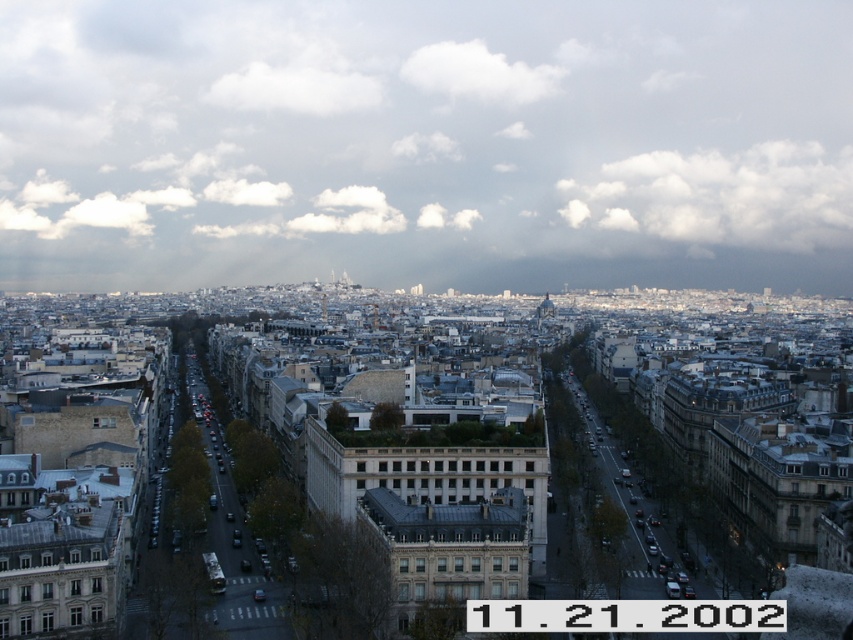
Question: Considering the relative positions of white fluffy clouds at upper center and white fluffy cloud at upper right in the image provided, where is white fluffy clouds at upper center located with respect to white fluffy cloud at upper right?

Choices:
 (A) right
 (B) left

Answer: (B)

Question: From the image, what is the correct spatial relationship of white fluffy clouds at upper center in relation to white fluffy cloud at upper center?

Choices:
 (A) right
 (B) left

Answer: (B)

Question: Based on their relative distances, which object is nearer to the white fluffy cloud at upper right?

Choices:
 (A) white fluffy cloud at upper center
 (B) white fluffy clouds at upper center

Answer: (B)

Question: From the image, what is the correct spatial relationship of white fluffy cloud at upper right in relation to white fluffy cloud at upper center?

Choices:
 (A) above
 (B) below

Answer: (B)

Question: Based on their relative distances, which object is farther from the white fluffy cloud at upper right?

Choices:
 (A) white fluffy cloud at upper center
 (B) white fluffy clouds at upper center

Answer: (A)

Question: Which of the following is the closest to the observer?

Choices:
 (A) (666, 227)
 (B) (502, 80)
 (C) (577, 12)

Answer: (A)